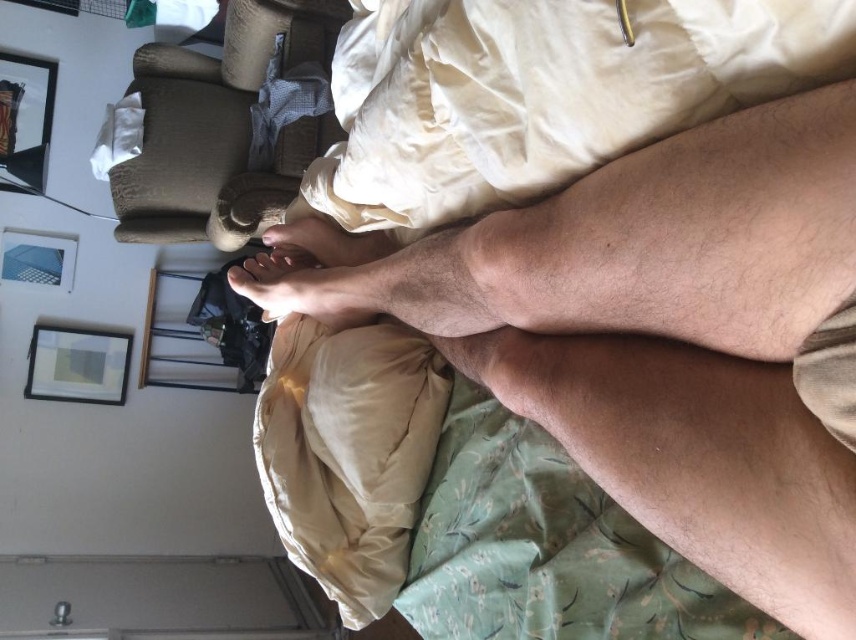
Is metallic silver picture frame at upper left to the right of skinny barefoot at center from the viewer's perspective?

Incorrect, metallic silver picture frame at upper left is not on the right side of skinny barefoot at center.

Locate an element on the screen. metallic silver picture frame at upper left is located at coordinates (37, 259).

Find the location of a particular element. This screenshot has width=856, height=640. metallic silver picture frame at upper left is located at coordinates (37, 259).

Can you confirm if wooden picture frame at upper left is positioned to the right of skinny barefoot at center?

No, wooden picture frame at upper left is not to the right of skinny barefoot at center.

Measure the distance from wooden picture frame at upper left to skinny barefoot at center.

A distance of 2.23 meters exists between wooden picture frame at upper left and skinny barefoot at center.

Who is more forward, (24, 129) or (342, 314)?

Point (342, 314) is in front.

Where is `wooden picture frame at upper left`? wooden picture frame at upper left is located at coordinates (24, 120).

The height and width of the screenshot is (640, 856). What do you see at coordinates (658, 336) in the screenshot? I see `hair-covered skin at center` at bounding box center [658, 336].

Can you confirm if hair-covered skin at center is positioned to the right of matte wooden picture frame at upper left?

Correct, you'll find hair-covered skin at center to the right of matte wooden picture frame at upper left.

Who is more distant from viewer, (x=623, y=305) or (x=40, y=396)?

Point (x=40, y=396)

The image size is (856, 640). What are the coordinates of `hair-covered skin at center` in the screenshot? It's located at (658, 336).